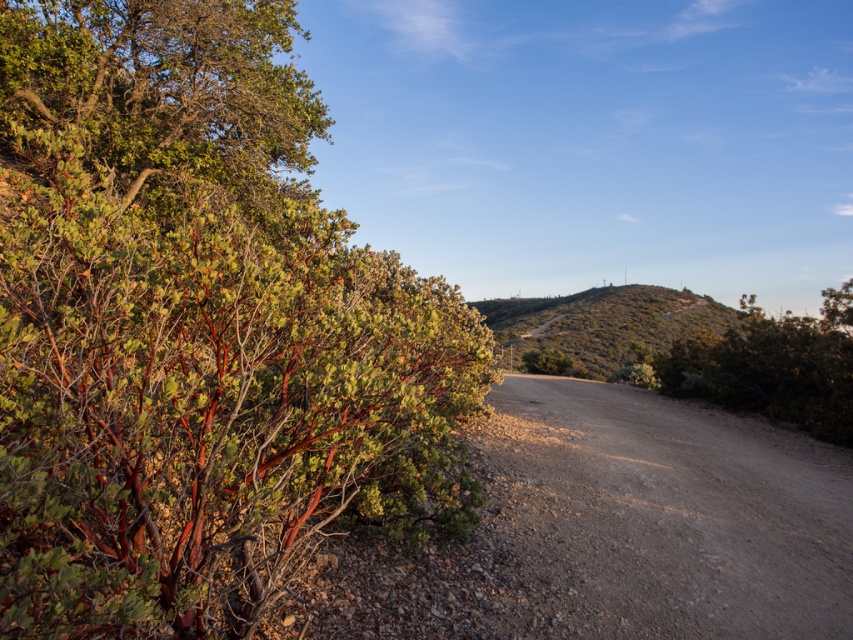
You are a hiker standing at the start of the dirt path and want to reach the green matte bush at center. Which direction should you go to avoid the green leafy bush at upper left?

The green leafy bush at upper left is above the green matte bush at center, so to avoid it, you should head towards the lower part of the path instead of going upwards.

You are a hiker planning to walk along the dirt path in the image. You notice two bushes ahead of you. The first is the green leafy bush at upper left, and the second is the green matte bush at center. Which bush is taller?

The green leafy bush at upper left is taller than the green matte bush at center.